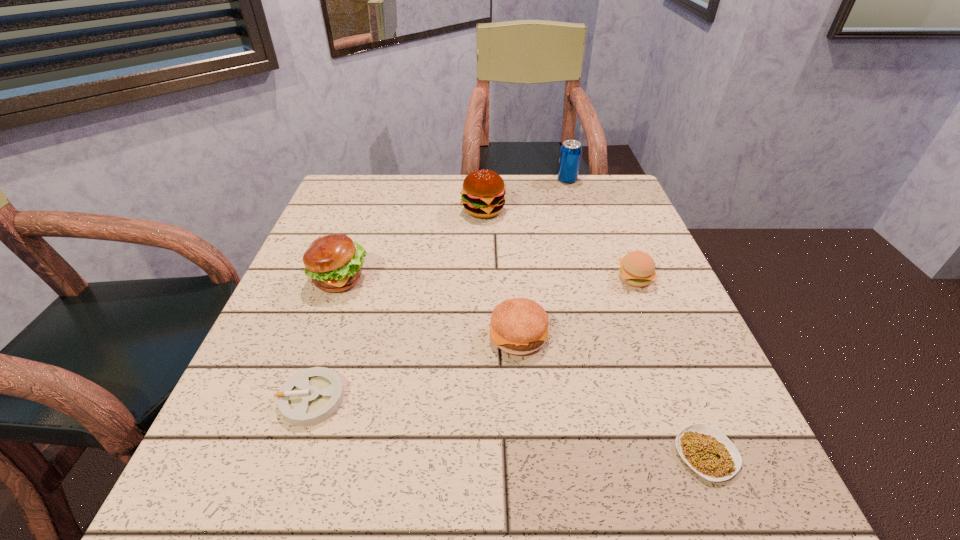
The image size is (960, 540). I want to click on free location located on the back of the leftmost hamburger, so click(x=357, y=230).

This screenshot has height=540, width=960. Identify the location of vacant space located on the front of the nearest hamburger. (524, 408).

The image size is (960, 540). What are the coordinates of `vacant space located 0.090m on the left of the rightmost hamburger` in the screenshot? It's located at (575, 278).

Where is `vacant space situated 0.360m on the back of the ashtray`? This screenshot has width=960, height=540. vacant space situated 0.360m on the back of the ashtray is located at coordinates (363, 247).

Where is `vacant area situated on the left of the legume`? The height and width of the screenshot is (540, 960). vacant area situated on the left of the legume is located at coordinates (520, 454).

Locate an element on the screen. pop soda positioned at the far edge is located at coordinates (570, 153).

Where is `hamburger at the far edge`? hamburger at the far edge is located at coordinates (483, 195).

Where is `object positioned at the near edge`? The image size is (960, 540). object positioned at the near edge is located at coordinates [706, 450].

I want to click on hamburger at the left edge, so click(334, 263).

This screenshot has width=960, height=540. I want to click on ashtray that is at the left edge, so click(x=311, y=396).